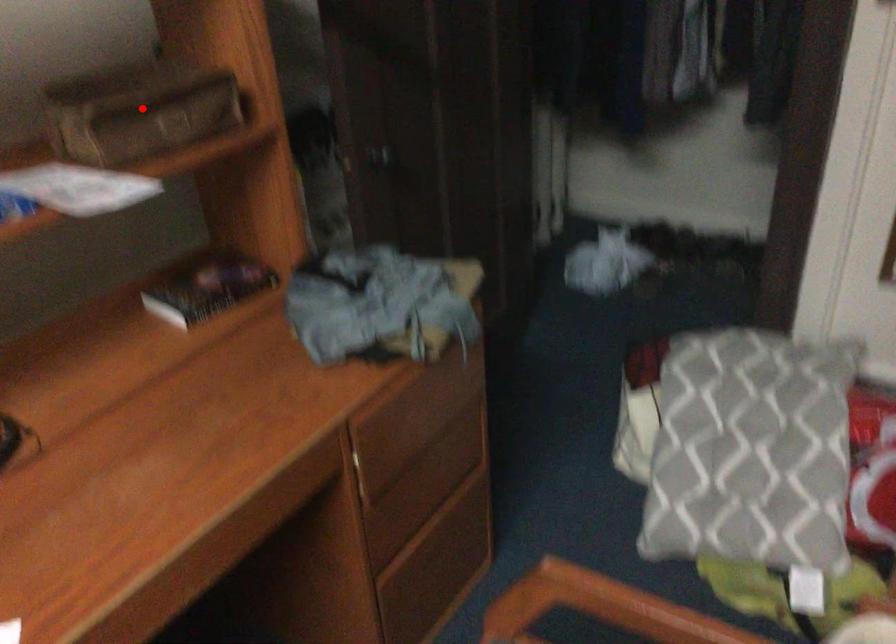
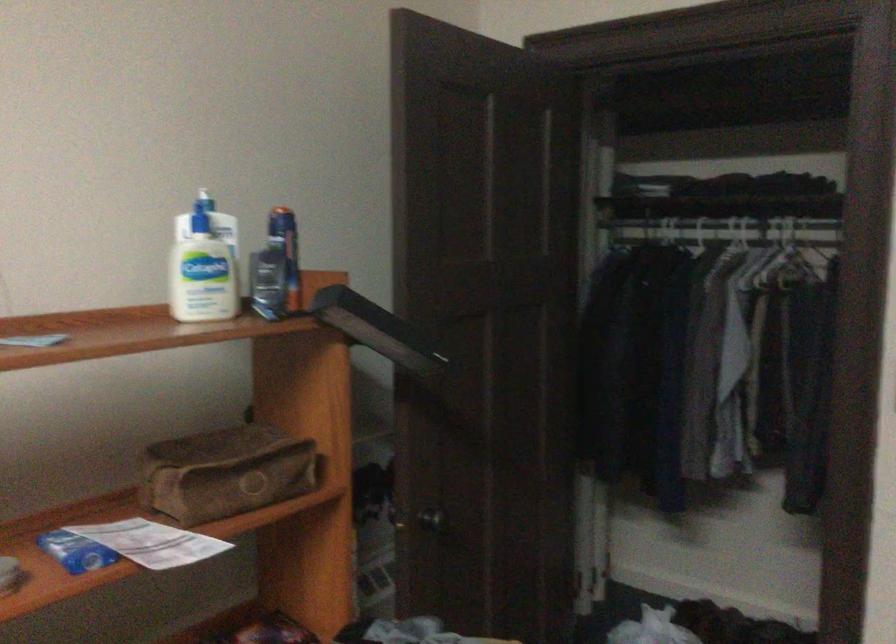
Locate, in the second image, the point that corresponds to the highlighted location in the first image.

(226, 471)